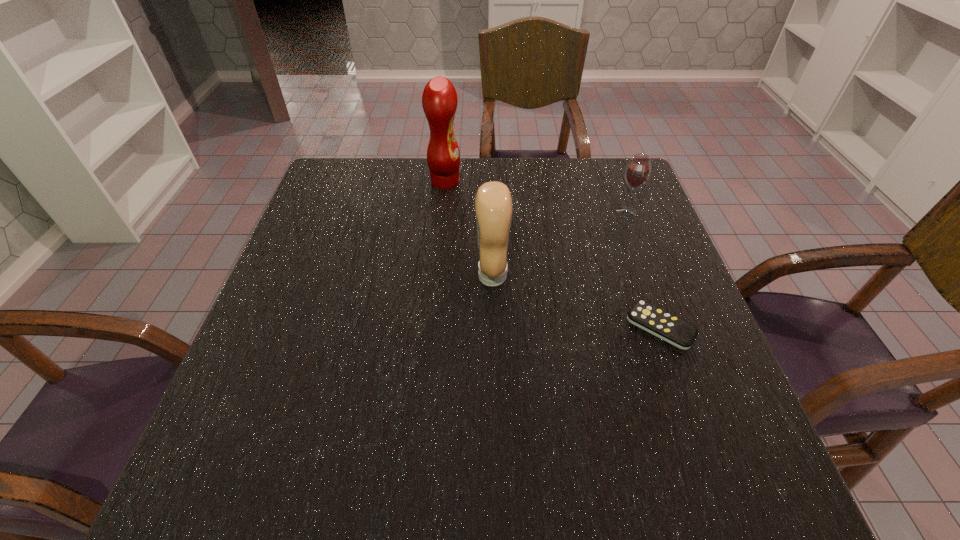
This screenshot has height=540, width=960. Find the location of `vacant space that satisfies the following two spatial constraints: 1. on the label side of the farthest object; 2. on the back side of the third nearest object`. vacant space that satisfies the following two spatial constraints: 1. on the label side of the farthest object; 2. on the back side of the third nearest object is located at coordinates (443, 212).